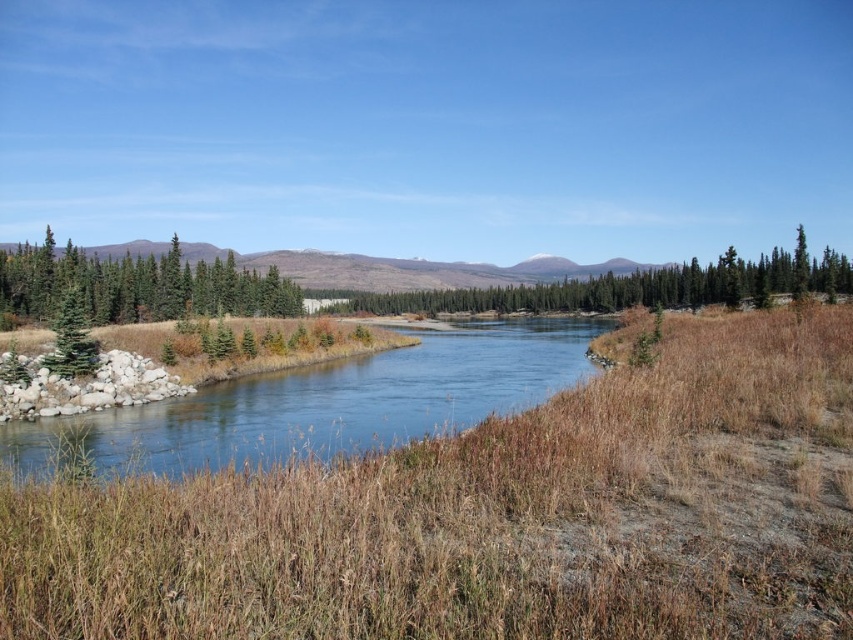
Question: Which of these objects is positioned farthest from the green textured trees at center?

Choices:
 (A) clear water at center
 (B) brown dry grass at center
 (C) green matte trees at left
 (D) green matte evergreen tree at left

Answer: (D)

Question: Is clear water at center to the left of green matte evergreen tree at left from the viewer's perspective?

Choices:
 (A) yes
 (B) no

Answer: (B)

Question: Can you confirm if clear water at center is smaller than green textured trees at center?

Choices:
 (A) no
 (B) yes

Answer: (B)

Question: Which object appears closest to the camera in this image?

Choices:
 (A) green matte evergreen tree at left
 (B) green matte trees at left
 (C) clear water at center
 (D) green textured trees at center

Answer: (C)

Question: Observing the image, what is the correct spatial positioning of green matte trees at left in reference to green textured trees at center?

Choices:
 (A) above
 (B) below

Answer: (B)

Question: Which of these objects is positioned farthest from the green textured trees at center?

Choices:
 (A) clear water at center
 (B) green matte trees at left

Answer: (B)